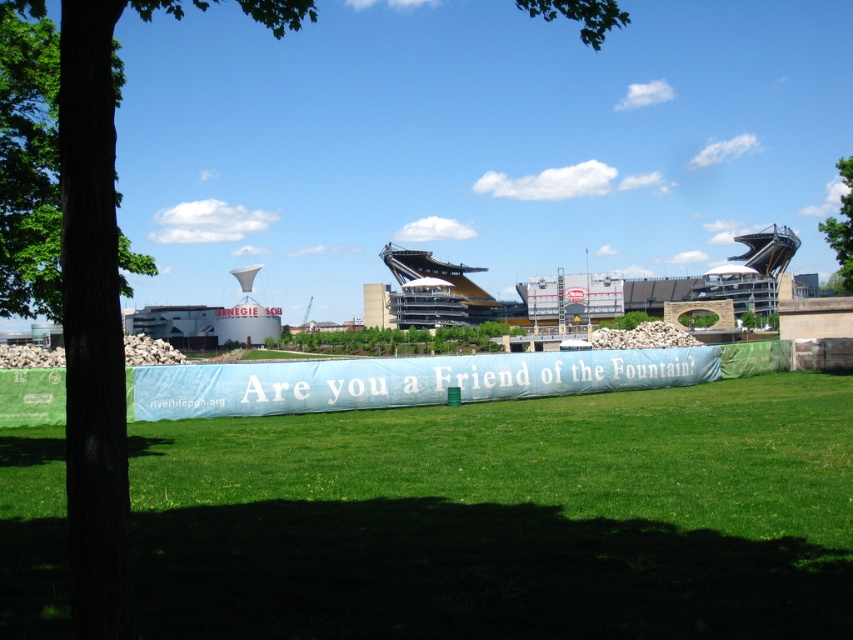
Does green rough bark tree at left have a lesser height compared to green leafy tree at center?

In fact, green rough bark tree at left may be taller than green leafy tree at center.

The width and height of the screenshot is (853, 640). Describe the element at coordinates (28, 163) in the screenshot. I see `green rough bark tree at left` at that location.

Is point (3, 150) positioned before point (405, 346)?

Yes.

Locate an element on the screen. The height and width of the screenshot is (640, 853). green rough bark tree at left is located at coordinates (28, 163).

Between green leafy tree at center-left and green leafy tree at center, which one appears on the left side from the viewer's perspective?

Positioned to the left is green leafy tree at center-left.

Where is `green leafy tree at center-left`? green leafy tree at center-left is located at coordinates (94, 316).

Can you confirm if green leafy tree at center-left is smaller than green leafy tree at upper right?

Yes.

Does green leafy tree at center-left appear under green leafy tree at upper right?

Actually, green leafy tree at center-left is above green leafy tree at upper right.

Describe the element at coordinates (94, 316) in the screenshot. I see `green leafy tree at center-left` at that location.

In order to click on green leafy tree at center-left in this screenshot , I will do `click(94, 316)`.